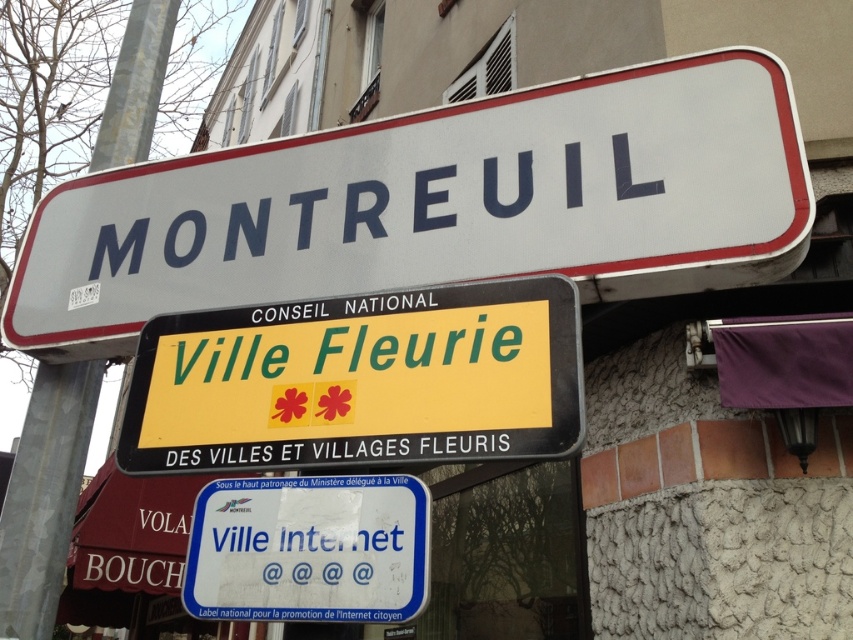
Question: Can you confirm if white plastic street sign at upper center is smaller than metallic pole at upper center?

Choices:
 (A) no
 (B) yes

Answer: (A)

Question: Can you confirm if blue plastic sign at center is smaller than metallic pole at upper center?

Choices:
 (A) no
 (B) yes

Answer: (B)

Question: Is white plastic street sign at upper center to the left of metallic pole at upper center from the viewer's perspective?

Choices:
 (A) yes
 (B) no

Answer: (B)

Question: Which of these objects is positioned closest to the blue plastic sign at center?

Choices:
 (A) yellow matte signboard at center
 (B) metallic pole at upper center
 (C) white plastic street sign at upper center

Answer: (A)

Question: Which object is positioned farthest from the blue plastic sign at center?

Choices:
 (A) white plastic street sign at upper center
 (B) metallic pole at upper center
 (C) yellow matte signboard at center

Answer: (B)

Question: Which is nearer to the white plastic street sign at upper center?

Choices:
 (A) metallic pole at upper center
 (B) blue plastic sign at center

Answer: (B)